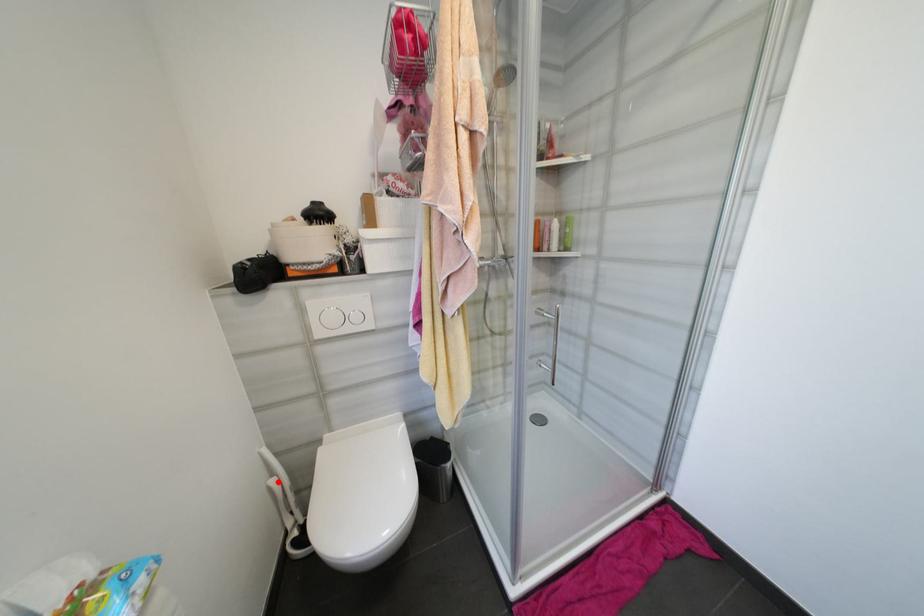
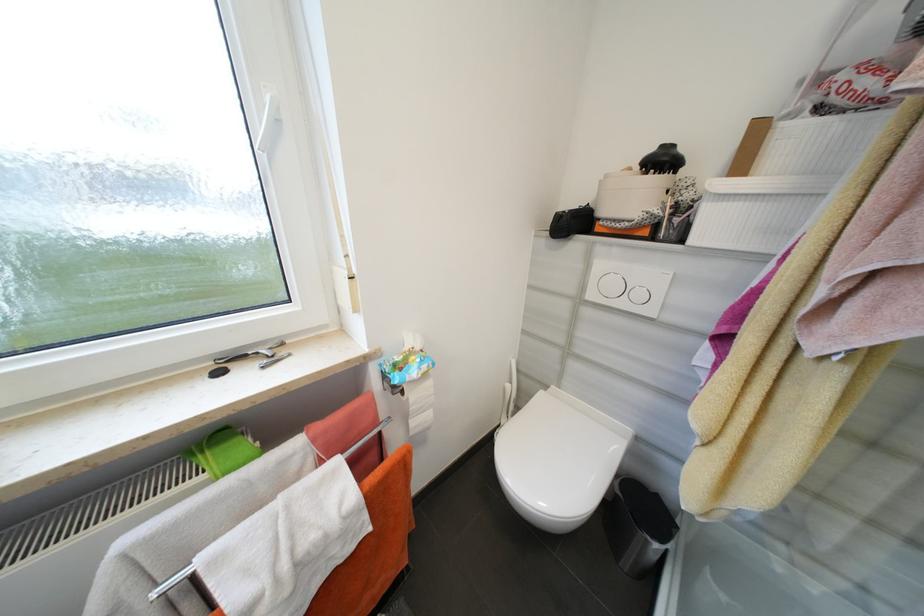
Locate, in the second image, the point that corresponds to the highlighted location in the first image.

(514, 387)